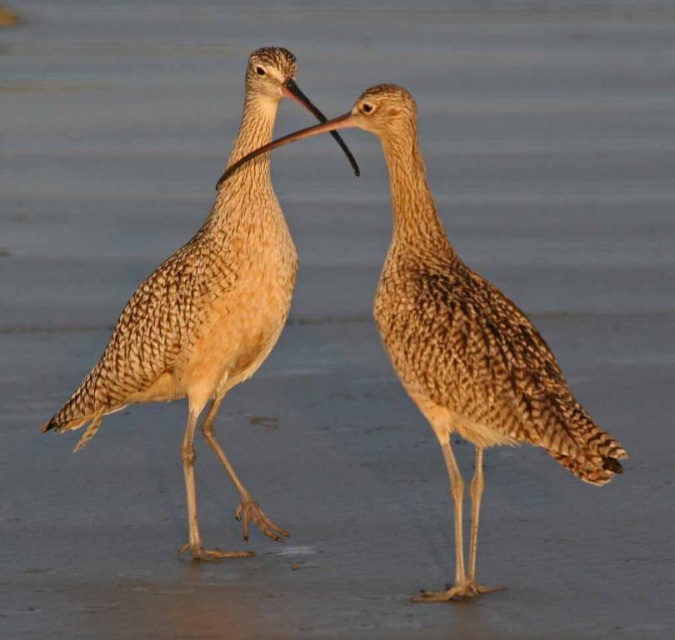
Looking at this image, you are a wildlife photographer aiming to capture a closeup of the brown speckled feathers at center and the speckled feathered shorebird at center. Based on the scene, which object would require you to zoom in more to focus on its details?

The brown speckled feathers at center might be wider than the speckled feathered shorebird at center, so you would need to zoom in more on the speckled feathered shorebird at center to focus on its details.

You are a birdwatcher observing two birds in a beach scene. You notice the brown speckled feathers at center and the speckled feathered shorebird at center. Which object is located to the right?

The brown speckled feathers at center is to the right of the speckled feathered shorebird at center.

You are a wildlife photographer aiming to capture a closeup of the brown speckled feathers at center and the speckled feathered shorebird at center. Since you want to focus on the feathers, which bird should you zoom in on more closely?

The brown speckled feathers at center are below the speckled feathered shorebird at center, so you should zoom in more closely on the speckled feathered shorebird at center to focus on its feathers.